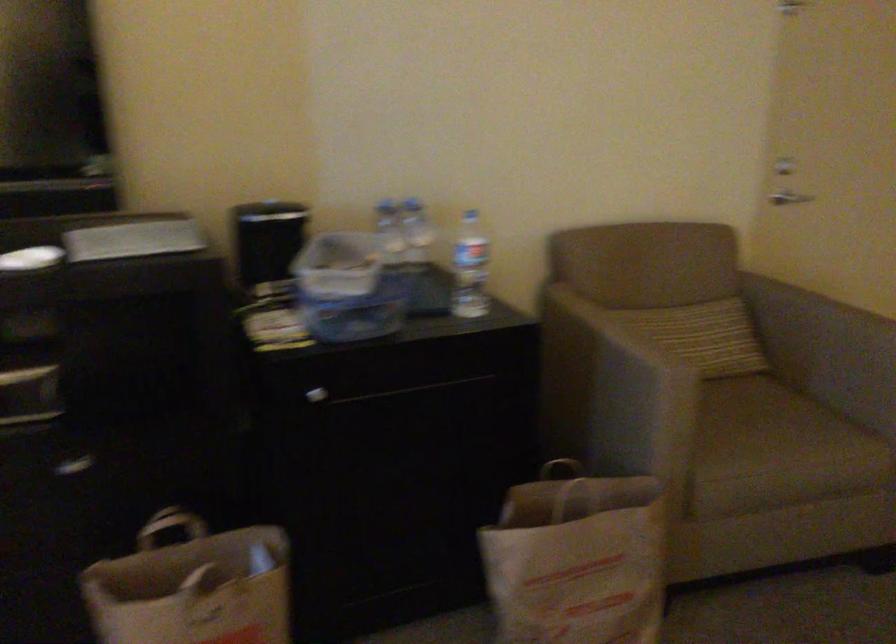
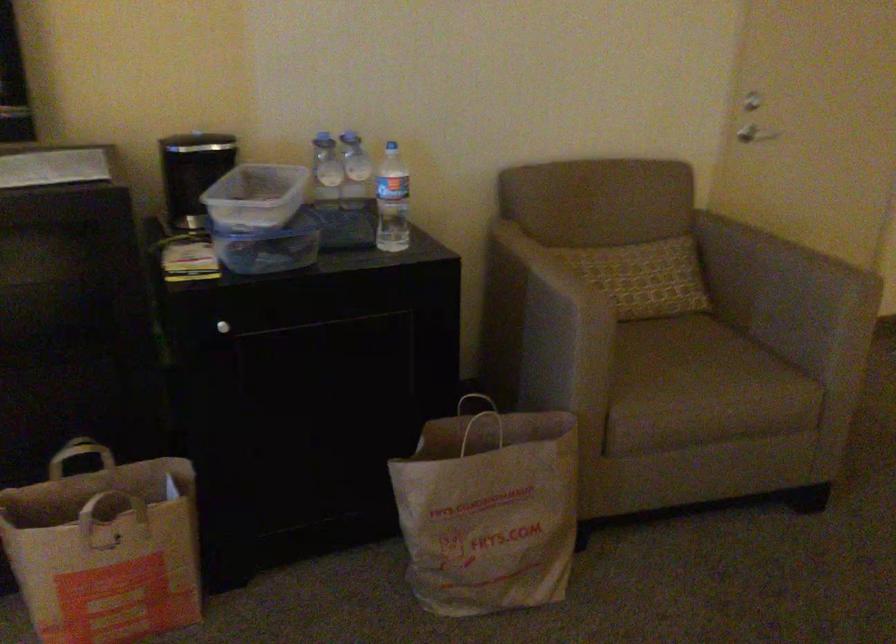
The point at (393, 234) is marked in the first image. Where is the corresponding point in the second image?

(325, 169)